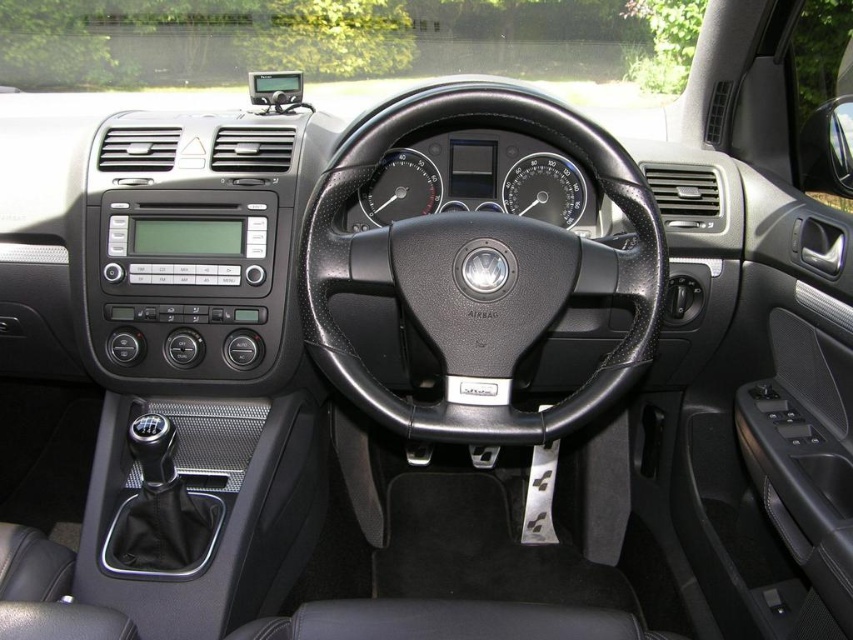
Can you confirm if black leather steering wheel at center is positioned above black rubber gauge at center?

Incorrect, black leather steering wheel at center is not positioned above black rubber gauge at center.

Who is taller, black leather steering wheel at center or black rubber gauge at center?

Standing taller between the two is black leather steering wheel at center.

Is point (486, 410) more distant than point (363, 208)?

No, (486, 410) is closer to viewer.

Identify the location of black leather steering wheel at center. Image resolution: width=853 pixels, height=640 pixels. (480, 275).

Describe the element at coordinates (480, 275) in the screenshot. This screenshot has height=640, width=853. I see `black leather steering wheel at center` at that location.

Which is above, black leather steering wheel at center or black plastic speedometer at center?

black plastic speedometer at center is above.

The width and height of the screenshot is (853, 640). Describe the element at coordinates (480, 275) in the screenshot. I see `black leather steering wheel at center` at that location.

Identify the location of black leather steering wheel at center. Image resolution: width=853 pixels, height=640 pixels. (480, 275).

Does black plastic speedometer at center have a lesser height compared to black rubber gauge at center?

Yes, black plastic speedometer at center is shorter than black rubber gauge at center.

Is point (527, 188) positioned after point (392, 212)?

That is True.

Identify the location of black plastic speedometer at center. The image size is (853, 640). (544, 189).

Locate an element on the screen. black plastic speedometer at center is located at coordinates (544, 189).